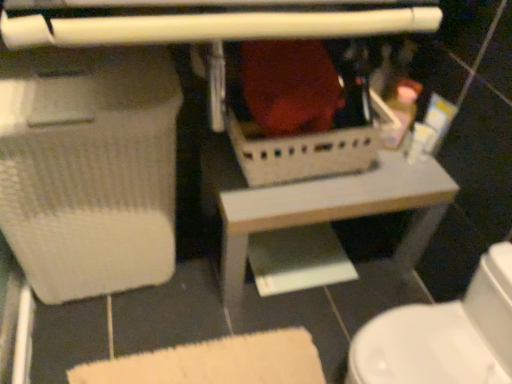
Question: Is point (426, 173) closer or farther from the camera than point (468, 331)?

Choices:
 (A) farther
 (B) closer

Answer: (A)

Question: Considering their positions, is white plastic basket at center located in front of or behind white glossy toilet at lower right?

Choices:
 (A) behind
 (B) front

Answer: (A)

Question: In terms of size, does white plastic basket at center appear bigger or smaller than white glossy toilet at lower right?

Choices:
 (A) big
 (B) small

Answer: (A)

Question: Is point (432, 339) closer or farther from the camera than point (398, 172)?

Choices:
 (A) farther
 (B) closer

Answer: (B)

Question: Considering their positions, is white glossy toilet at lower right located in front of or behind white plastic basket at center?

Choices:
 (A) behind
 (B) front

Answer: (B)

Question: In terms of height, does white glossy toilet at lower right look taller or shorter compared to white plastic basket at center?

Choices:
 (A) short
 (B) tall

Answer: (B)

Question: In the image, is white glossy toilet at lower right on the left side or the right side of white plastic basket at center?

Choices:
 (A) right
 (B) left

Answer: (A)